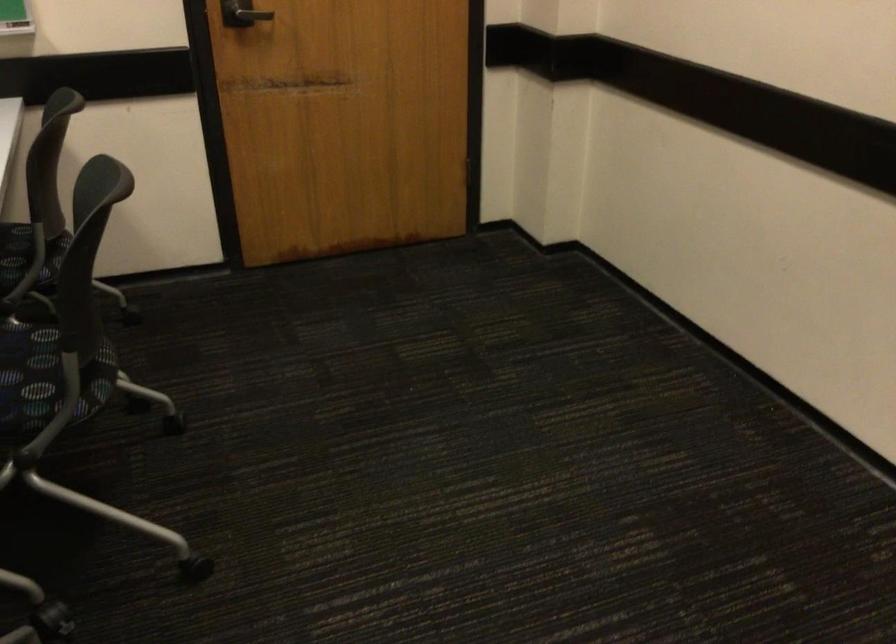
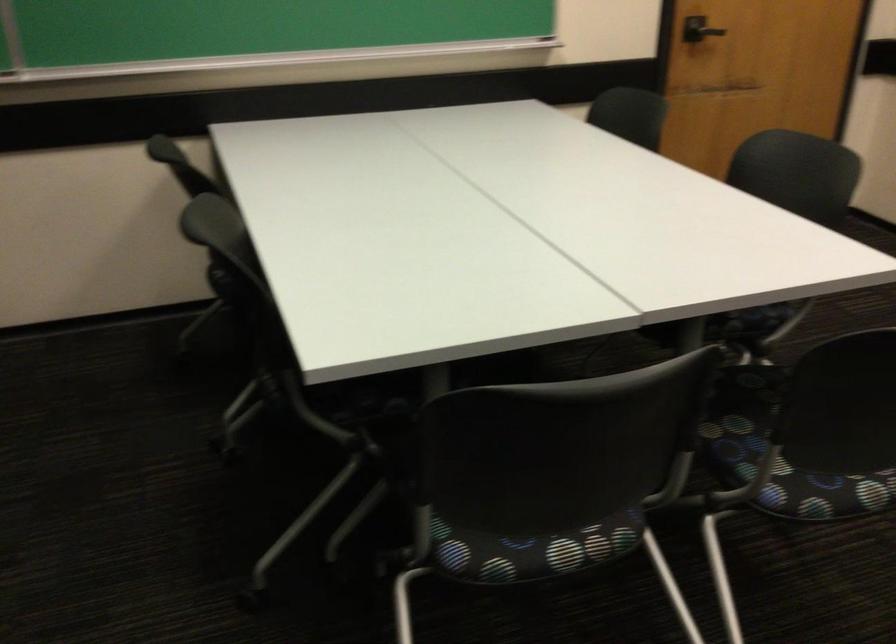
The images are taken continuously from a first-person perspective. In which direction are you moving?

The movement direction of the cameraman is left, backward.